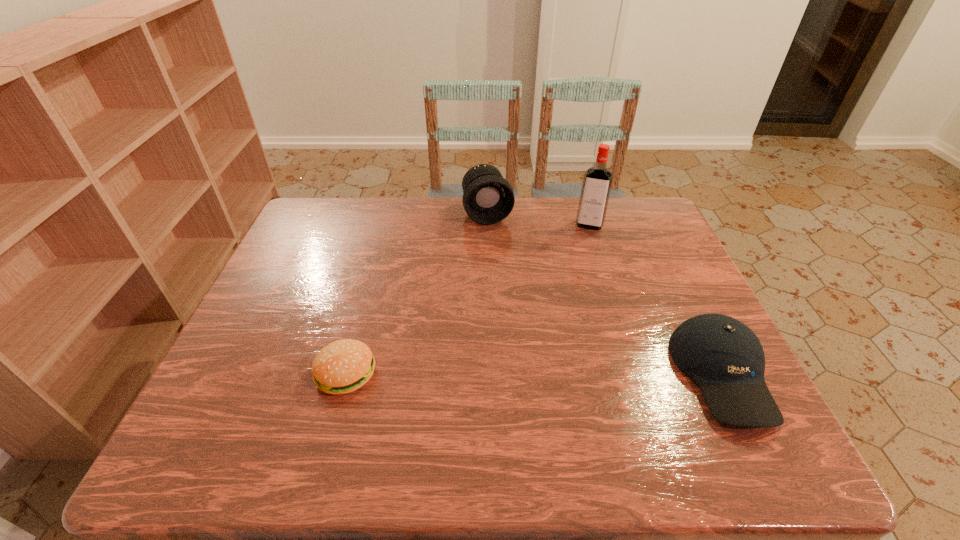
Find the location of a particular element. vacant region between the leftmost object and the third object from left to right is located at coordinates (468, 300).

This screenshot has height=540, width=960. Find the location of `unoccupied position between the second object from left to right and the second object from right to left`. unoccupied position between the second object from left to right and the second object from right to left is located at coordinates (539, 219).

Find the location of `free space between the vodka and the telephoto lens`. free space between the vodka and the telephoto lens is located at coordinates (539, 219).

In order to click on free point between the rightmost object and the tallest object in this screenshot , I will do point(656,300).

Identify the location of vacant area that lies between the rightmost object and the vodka. (656, 300).

You are a GUI agent. You are given a task and a screenshot of the screen. Output one action in this format:
    pyautogui.click(x=<x>, y=<y>)
    Task: Click on the vacant area that lies between the third object from left to right and the telephoto lens
    This screenshot has width=960, height=540.
    Given the screenshot: What is the action you would take?
    pyautogui.click(x=539, y=219)

Locate an element on the screen. The image size is (960, 540). free space between the rightmost object and the second object from left to right is located at coordinates (605, 294).

Identify the location of object identified as the second closest to the vodka. This screenshot has height=540, width=960. (724, 357).

Image resolution: width=960 pixels, height=540 pixels. Find the location of `object that is the third closest one to the patty`. object that is the third closest one to the patty is located at coordinates (597, 181).